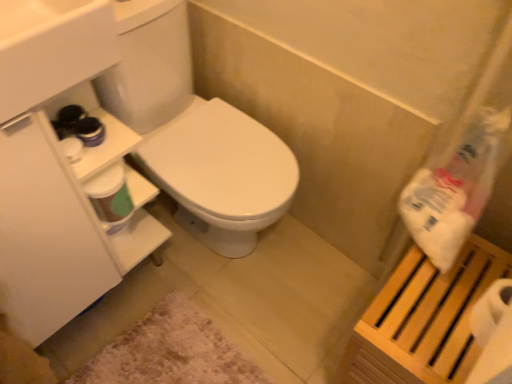
This screenshot has width=512, height=384. Find the location of `free space to the right of white fluffy bath mat at lower center`. free space to the right of white fluffy bath mat at lower center is located at coordinates (301, 317).